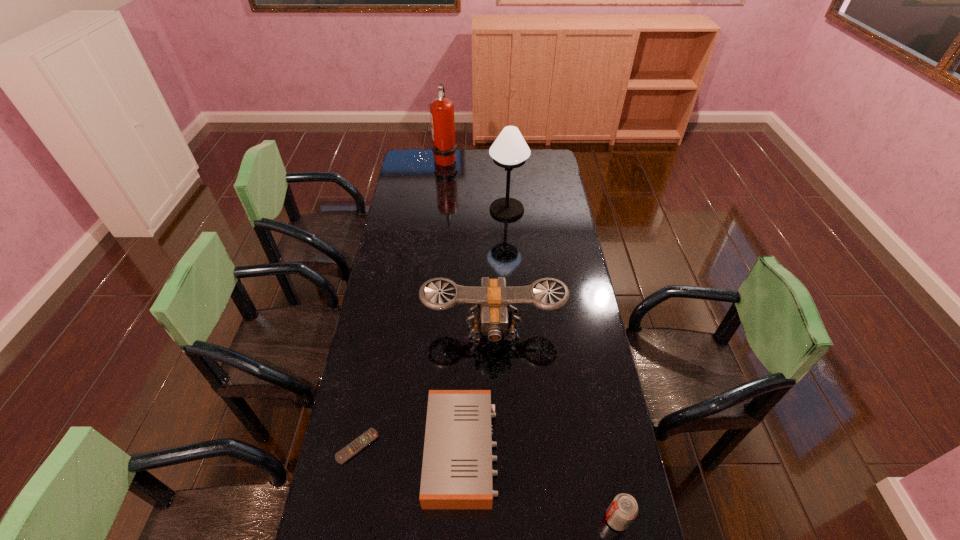
At what (x,y) coordinates should I click in order to perform the action: click on vacant point located on the front of the table lamp. Please return your answer as a coordinate pair (x, y). Looking at the image, I should click on (512, 280).

In order to click on free space located on the front-facing side of the drone in this screenshot , I will do `click(494, 374)`.

Where is `vacant space situated 0.170m on the left of the rightmost object`? Image resolution: width=960 pixels, height=540 pixels. vacant space situated 0.170m on the left of the rightmost object is located at coordinates (542, 519).

Where is `vacant space situated on the control panel of the fifth tallest object`? This screenshot has height=540, width=960. vacant space situated on the control panel of the fifth tallest object is located at coordinates (607, 451).

The height and width of the screenshot is (540, 960). Identify the location of vacant space located 0.190m on the back of the leftmost object. (372, 376).

Find the location of a particular element. The image size is (960, 540). object positioned at the far edge is located at coordinates (444, 149).

I want to click on object positioned at the left edge, so click(346, 453).

This screenshot has width=960, height=540. I want to click on drone that is at the right edge, so click(493, 298).

Identify the location of soda can that is at the right edge. The width and height of the screenshot is (960, 540). (622, 511).

This screenshot has width=960, height=540. I want to click on vacant region at the far edge of the desktop, so click(x=465, y=149).